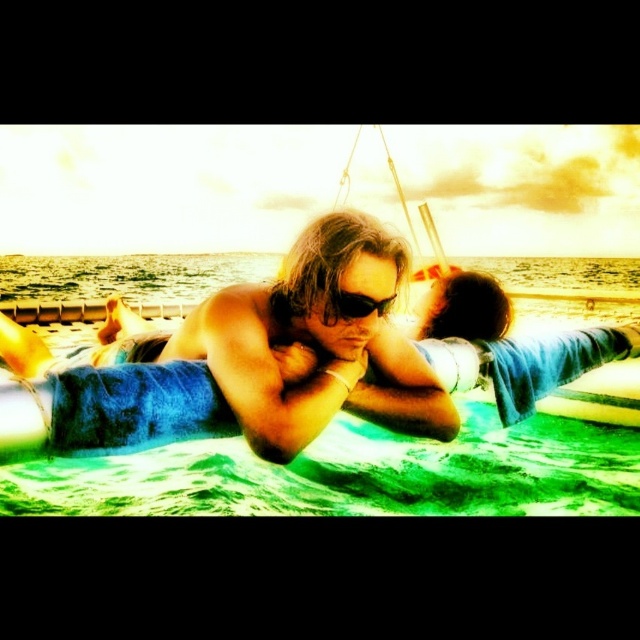
Question: From the image, what is the correct spatial relationship of blue towel at center in relation to black plastic goggles at center?

Choices:
 (A) above
 (B) below

Answer: (B)

Question: Observing the image, what is the correct spatial positioning of blue towel at center in reference to black plastic goggles at center?

Choices:
 (A) right
 (B) left

Answer: (A)

Question: Among these points, which one is farthest from the camera?

Choices:
 (A) (93, 385)
 (B) (336, 323)

Answer: (B)

Question: Does blue towel at center appear under black plastic goggles at center?

Choices:
 (A) yes
 (B) no

Answer: (A)